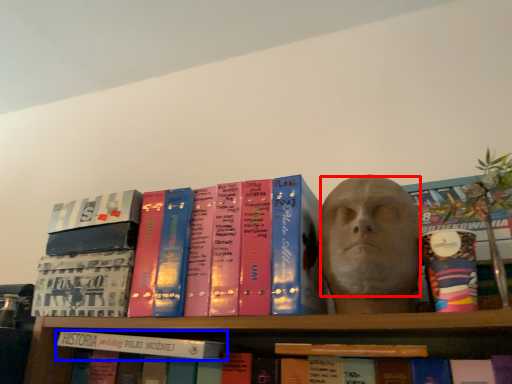
Question: Which of the following is the farthest to the observer, human face (highlighted by a red box) or book (highlighted by a blue box)?

Choices:
 (A) human face
 (B) book

Answer: (B)